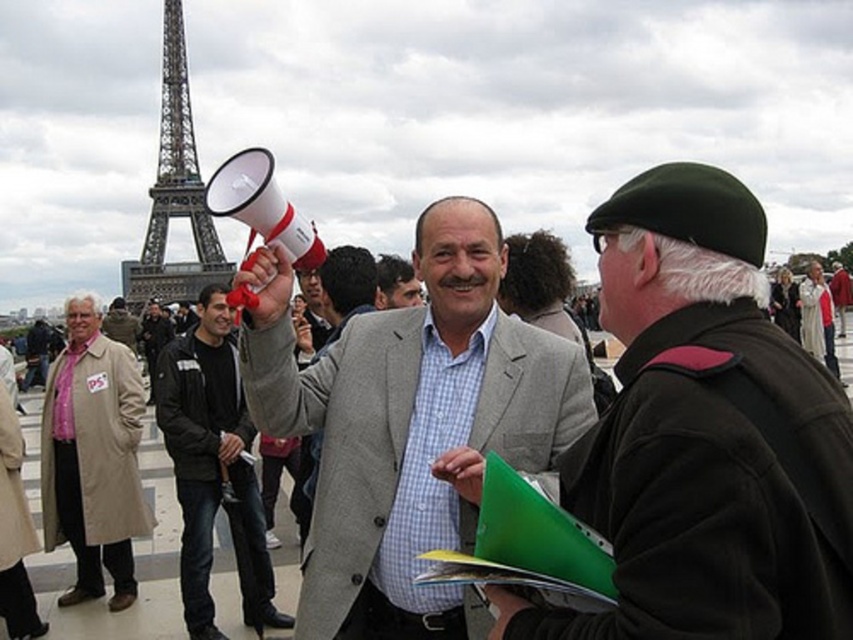
Is beige wool coat at left positioned in front of matte black jacket at center?

Yes, it is.

Between beige wool coat at left and matte black jacket at center, which one is positioned higher?

Positioned higher is beige wool coat at left.

Identify the location of beige wool coat at left. The height and width of the screenshot is (640, 853). (93, 458).

Find the location of `beige wool coat at left`. beige wool coat at left is located at coordinates (93, 458).

This screenshot has height=640, width=853. Find the location of `matte black jacket at center`. matte black jacket at center is located at coordinates (213, 465).

Which is behind, point (207, 618) or point (164, 154)?

The point (164, 154) is more distant.

You are a GUI agent. You are given a task and a screenshot of the screen. Output one action in this format:
    pyautogui.click(x=<x>, y=<y>)
    Task: Click on the matte black jacket at center
    This screenshot has height=640, width=853.
    Given the screenshot: What is the action you would take?
    pyautogui.click(x=213, y=465)

Which is in front, point (515, 609) or point (178, 104)?

Point (515, 609)

Who is positioned more to the right, light gray wool jacket at center or metallic gray eiffel tower at upper left?

light gray wool jacket at center is more to the right.

Is point (793, 403) farther from viewer compared to point (184, 172)?

No, it is not.

I want to click on light gray wool jacket at center, so click(x=704, y=435).